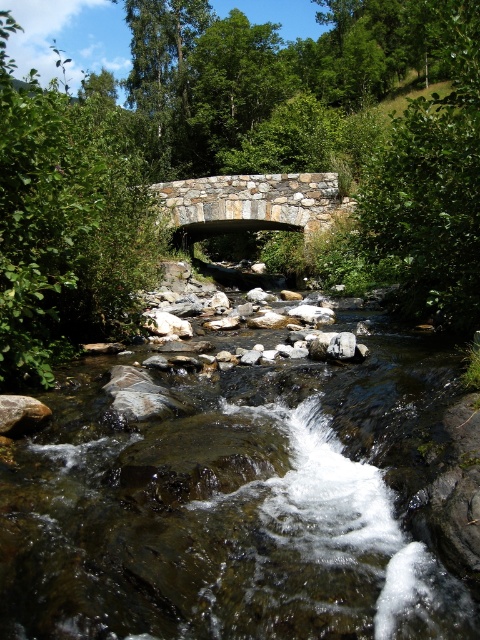
You are a hiker who wants to cross the stream using the rocks. You see the gray rock at lower left and the smooth gray rock at center. Which rock is located underneath the other?

The gray rock at lower left is positioned under the smooth gray rock at center, so the gray rock at lower left is underneath the smooth gray rock at center.